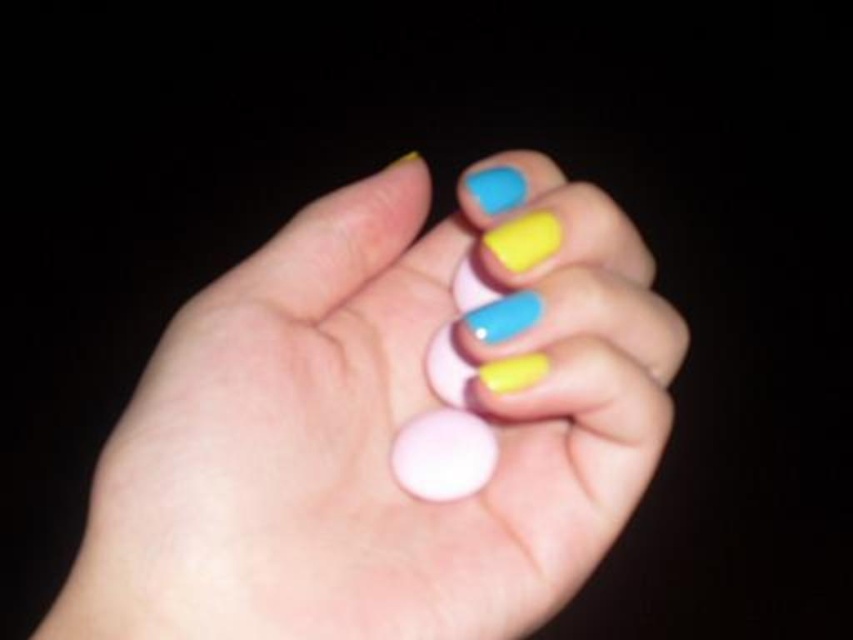
Does point (57, 621) come closer to viewer compared to point (474, 193)?

Yes, it is in front of point (474, 193).

Can you confirm if matte plastic hand at center is positioned to the right of matte blue nail polish at center?

Incorrect, matte plastic hand at center is not on the right side of matte blue nail polish at center.

Locate an element on the screen. The width and height of the screenshot is (853, 640). matte plastic hand at center is located at coordinates (378, 428).

Where is `matte plastic hand at center`? This screenshot has height=640, width=853. matte plastic hand at center is located at coordinates (378, 428).